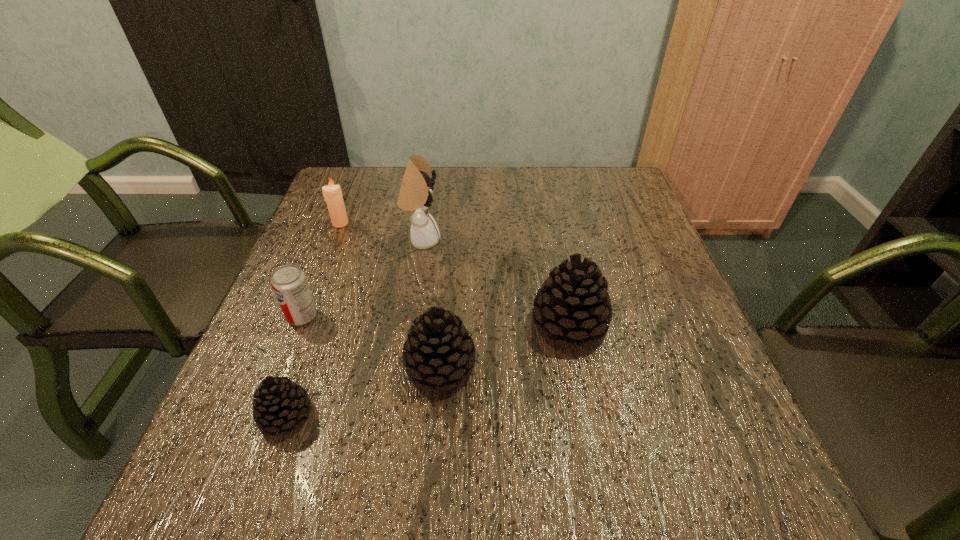
You are a GUI agent. You are given a task and a screenshot of the screen. Output one action in this format:
    pyautogui.click(x=<x>, y=<y>)
    Task: Click on the vacant spot to place a pinecone on the right
    The width and height of the screenshot is (960, 540).
    Given the screenshot: What is the action you would take?
    pyautogui.click(x=678, y=289)